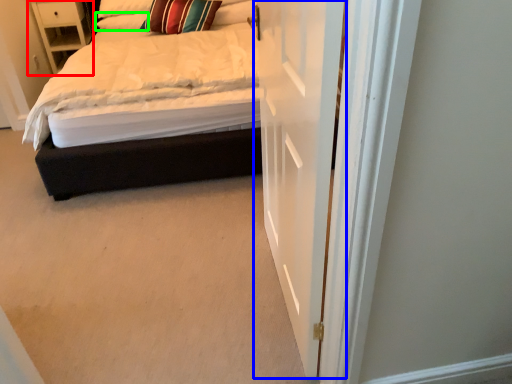
Question: Considering the real-world distances, which object is farthest from nightstand (highlighted by a red box)? door (highlighted by a blue box) or pillow (highlighted by a green box)?

Choices:
 (A) door
 (B) pillow

Answer: (A)